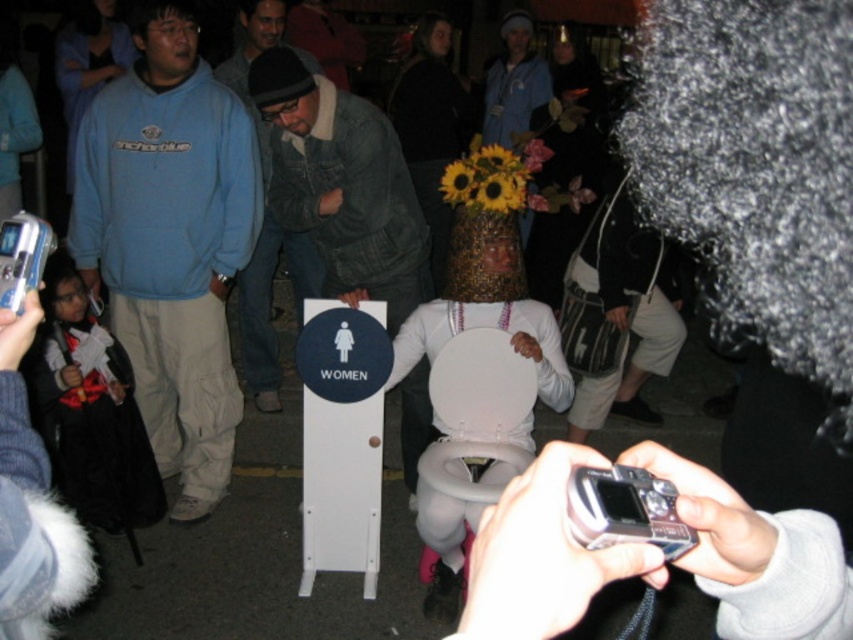
Between blue fleece sweatshirt at left and denim jacket at left, which one is positioned higher?

denim jacket at left

What do you see at coordinates (170, 241) in the screenshot? Image resolution: width=853 pixels, height=640 pixels. I see `blue fleece sweatshirt at left` at bounding box center [170, 241].

You are a GUI agent. You are given a task and a screenshot of the screen. Output one action in this format:
    pyautogui.click(x=<x>, y=<y>)
    Task: Click on the blue fleece sweatshirt at left
    The height and width of the screenshot is (640, 853).
    Given the screenshot: What is the action you would take?
    pyautogui.click(x=170, y=241)

Does blue fleece sweatshirt at left appear on the right side of white plastic toilet at center?

In fact, blue fleece sweatshirt at left is to the left of white plastic toilet at center.

Between blue fleece sweatshirt at left and white plastic toilet at center, which one has more height?

blue fleece sweatshirt at left is taller.

Which is behind, point (209, 184) or point (465, 273)?

The point (209, 184) is behind.

Locate an element on the screen. blue fleece sweatshirt at left is located at coordinates (170, 241).

Between blue fleece sweatshirt at left and denim jacket at center, which one appears on the left side from the viewer's perspective?

Positioned to the left is blue fleece sweatshirt at left.

Is blue fleece sweatshirt at left thinner than denim jacket at center?

Incorrect, blue fleece sweatshirt at left's width is not less than denim jacket at center's.

What do you see at coordinates (170, 241) in the screenshot? Image resolution: width=853 pixels, height=640 pixels. I see `blue fleece sweatshirt at left` at bounding box center [170, 241].

You are a GUI agent. You are given a task and a screenshot of the screen. Output one action in this format:
    pyautogui.click(x=<x>, y=<y>)
    Task: Click on the blue fleece sweatshirt at left
    
    Given the screenshot: What is the action you would take?
    pyautogui.click(x=170, y=241)